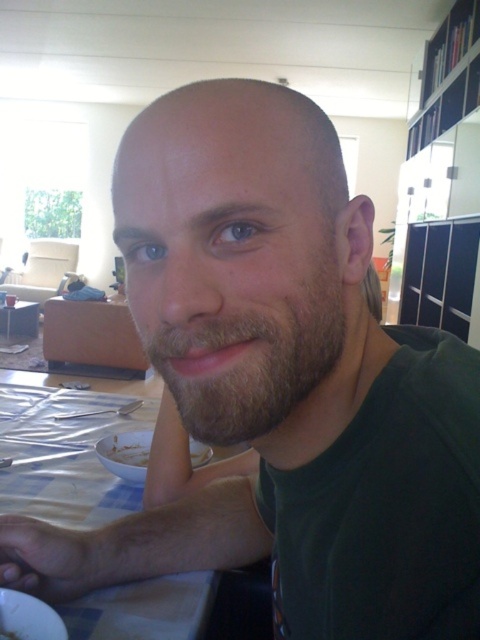
Is brown fuzzy beard at center to the right of white matte plate at lower left from the viewer's perspective?

Indeed, brown fuzzy beard at center is positioned on the right side of white matte plate at lower left.

How much distance is there between brown fuzzy beard at center and white matte plate at lower left?

brown fuzzy beard at center is 21.27 inches from white matte plate at lower left.

Between point (243, 406) and point (208, 452), which one is positioned behind?

The point (208, 452) is behind.

In order to click on brown fuzzy beard at center in this screenshot , I will do `click(252, 358)`.

Who is lower down, wooden table at center or white matte plate at lower left?

white matte plate at lower left is below.

The height and width of the screenshot is (640, 480). Find the location of `wooden table at center`. wooden table at center is located at coordinates (20, 320).

Can you confirm if white checkered tablecloth at lower left is positioned above white matte plate at lower left?

Actually, white checkered tablecloth at lower left is below white matte plate at lower left.

Locate an element on the screen. The image size is (480, 640). white checkered tablecloth at lower left is located at coordinates (63, 456).

Where is `white checkered tablecloth at lower left`? This screenshot has width=480, height=640. white checkered tablecloth at lower left is located at coordinates (63, 456).